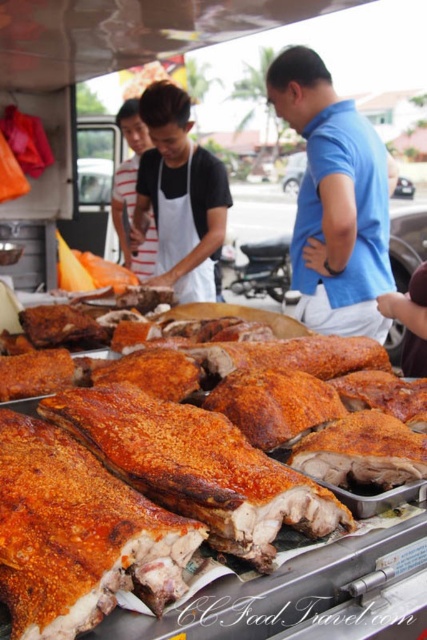
Question: Does white apron at center appear on the right side of golden crispy roasted pork at center?

Choices:
 (A) yes
 (B) no

Answer: (B)

Question: Is white apron at center wider than golden crispy roasted pork at center?

Choices:
 (A) yes
 (B) no

Answer: (A)

Question: Does white apron at center appear on the left side of golden crispy roasted pork at center?

Choices:
 (A) no
 (B) yes

Answer: (B)

Question: Which object is closer to the camera taking this photo?

Choices:
 (A) white fabric apron at center
 (B) golden crispy roasted pork at center
 (C) blue cotton shirt at center
 (D) white apron at center

Answer: (B)

Question: Which of the following is the farthest from the observer?

Choices:
 (A) golden crispy roasted pork at center
 (B) white apron at center
 (C) white fabric apron at center

Answer: (C)

Question: Which is nearer to the blue cotton shirt at center?

Choices:
 (A) white fabric apron at center
 (B) white apron at center
 (C) golden crispy roasted pork at center

Answer: (B)